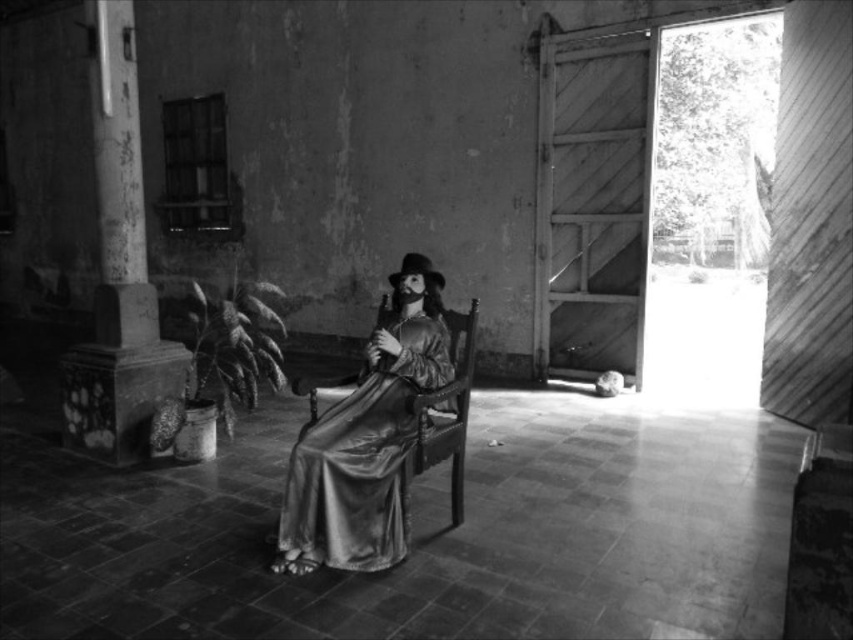
You are an interior designer assessing the space for a new sculpture. The sculpture will be placed between the silky gold dress at center and the smooth stone column at left. Considering their heights, which object should the sculpture be taller than to ensure it stands out?

The silky gold dress at center is shorter than the smooth stone column at left. To ensure the sculpture stands out, it should be taller than the smooth stone column at left.

You are an interior designer planning to place a new sofa in this old building. The current room has a silky gold dress at center. Where exactly should you place the sofa so that it doesn not block the dress?

The silky gold dress at center is located at point (366, 440). To avoid blocking it, place the sofa away from this coordinate.